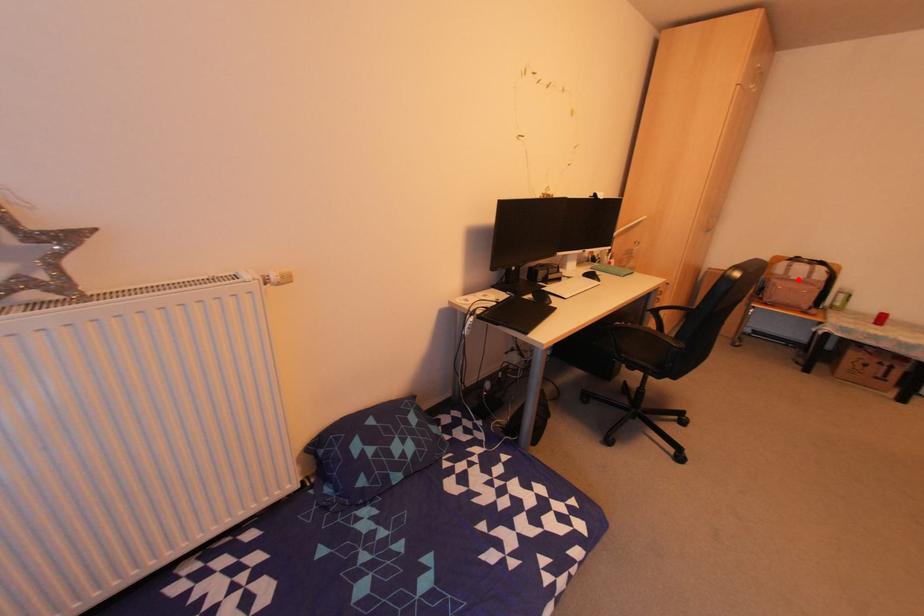
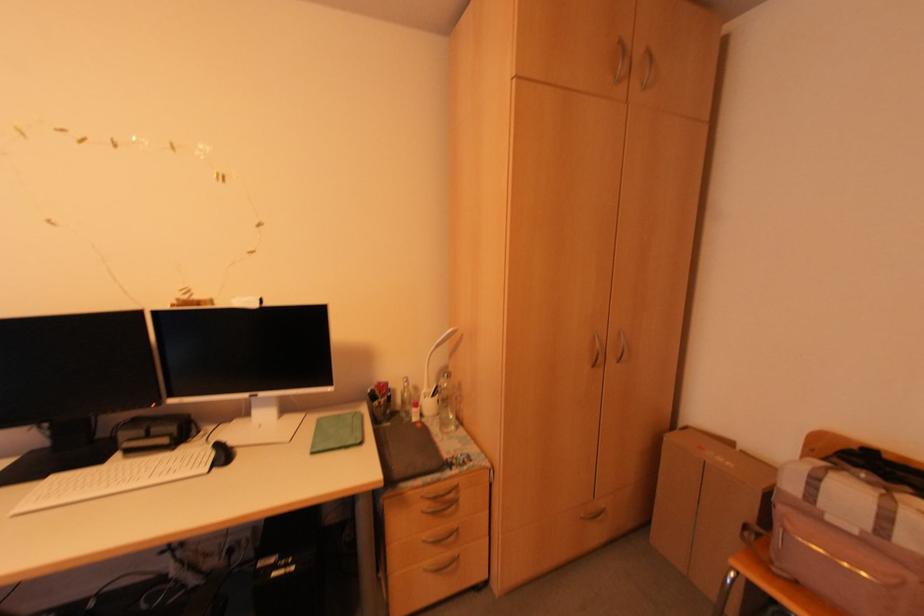
Question: I am providing you with two images of the same scene from different viewpoints. In image1, a red point is highlighted. Considering the same 3D point in image2, which of the following is correct?

Choices:
 (A) It is closer
 (B) It is farther

Answer: (A)